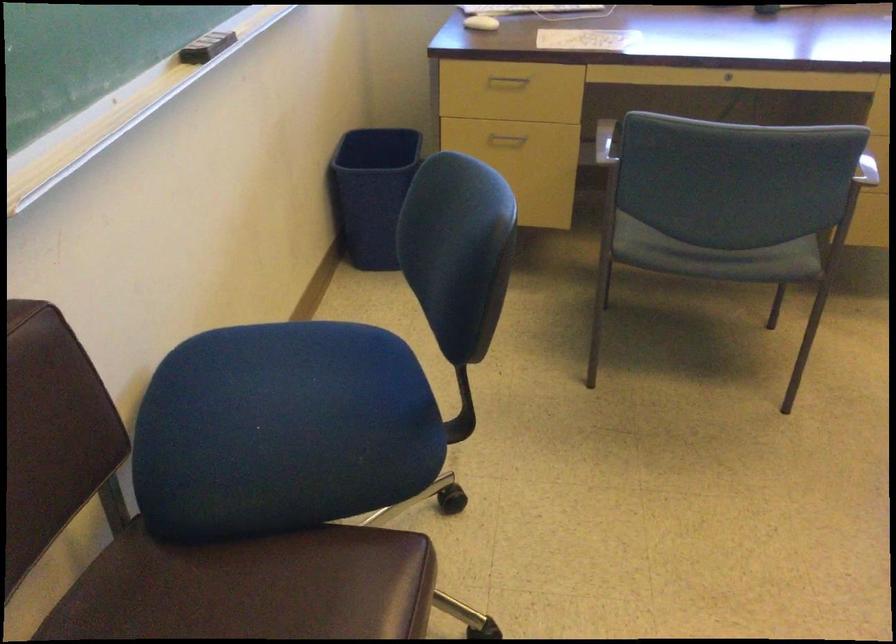
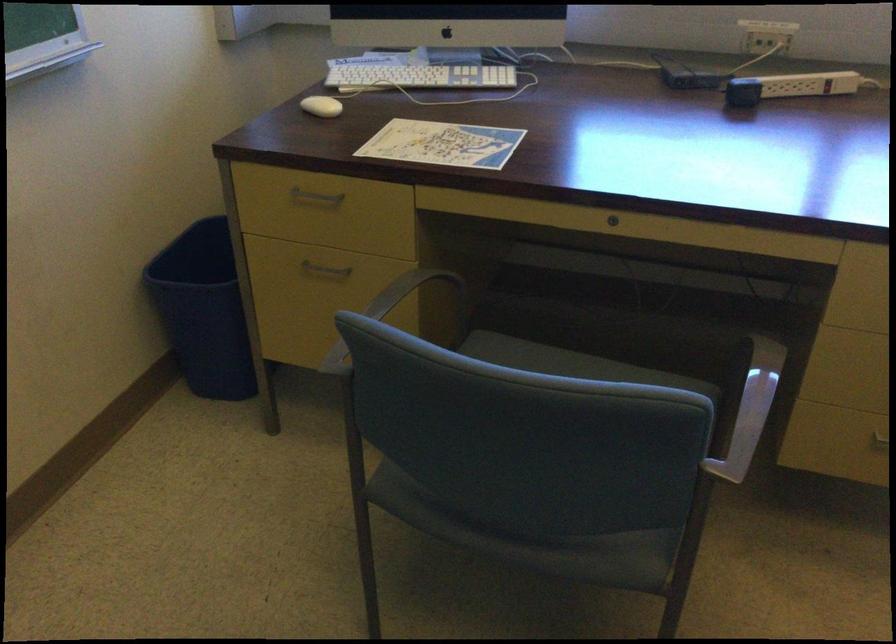
In the second image, find the point that corresponds to point (736, 259) in the first image.

(538, 542)